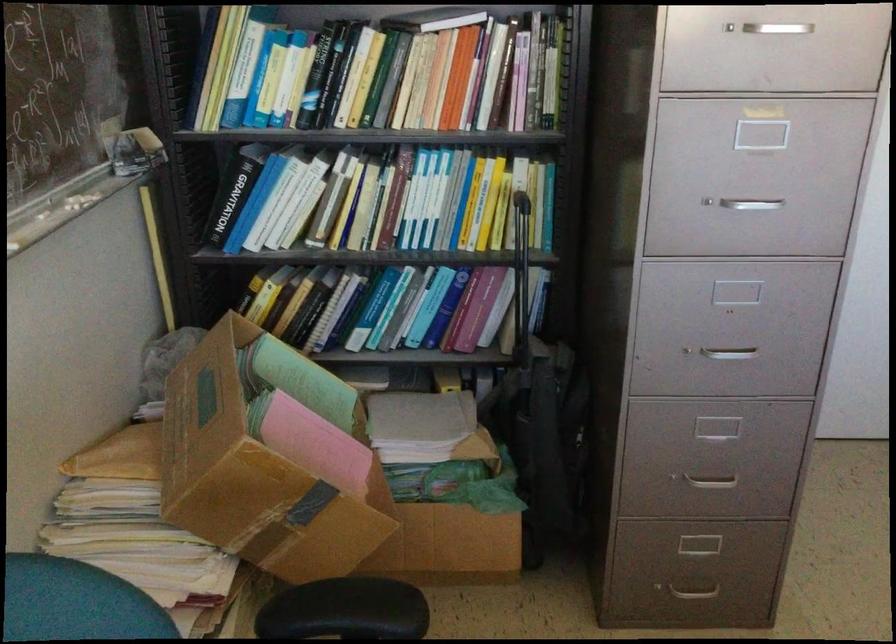
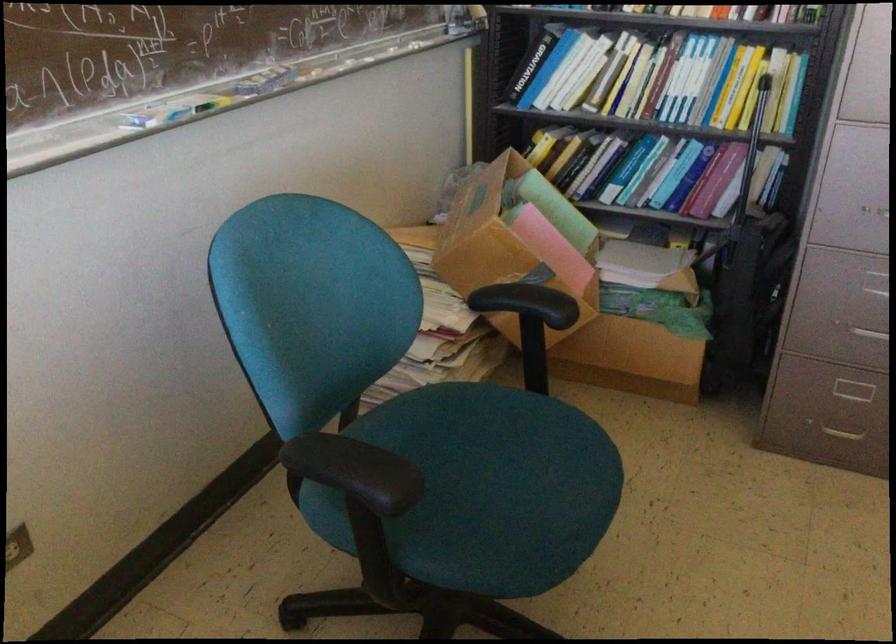
In the second image, find the point that corresponds to (696,353) in the first image.

(877, 214)